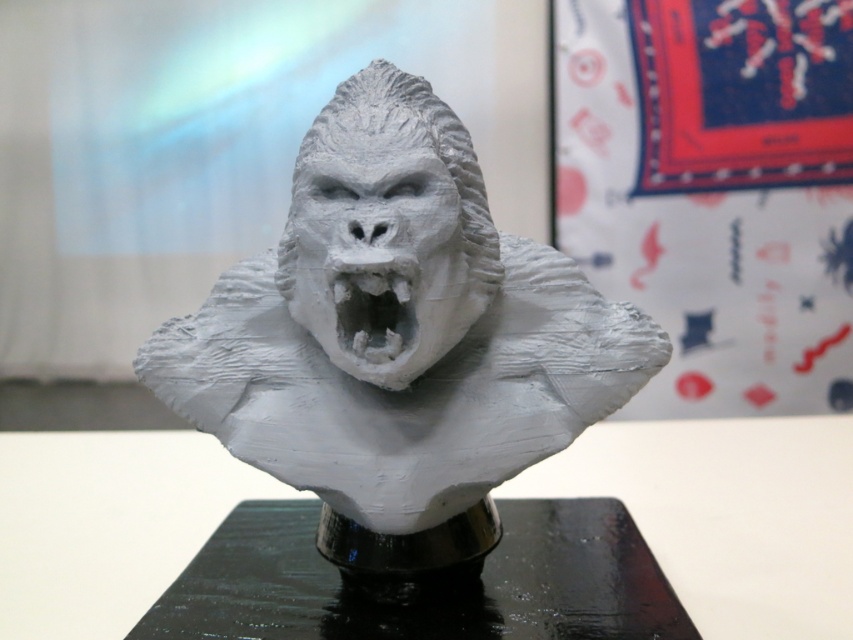
You are an art installer setting up the gorilla bust. You need to ensure the white matte plastic mouth at center is securely attached to the black glossy table at center. Based on their positions, which object should you focus on first to ensure stability?

The black glossy table at center is below the white matte plastic mouth at center, so you should focus on securing the black glossy table at center first to ensure stability.

You are an art curator examining the image. You need to determine the spatial relationship between the white matte gorilla bust at center and the black glossy table at center. Which object is positioned closer to the viewer?

The white matte gorilla bust at center is closer to the viewer than the black glossy table at center.

You are an art installer who needs to place a small 10 cm wide decorative item on the table. Given the black glossy table at center and the white matte plastic mouth at center, which object can accommodate the item in terms of width?

The black glossy table at center has a larger width than the white matte plastic mouth at center, so the black glossy table at center can accommodate the 10 cm wide decorative item.